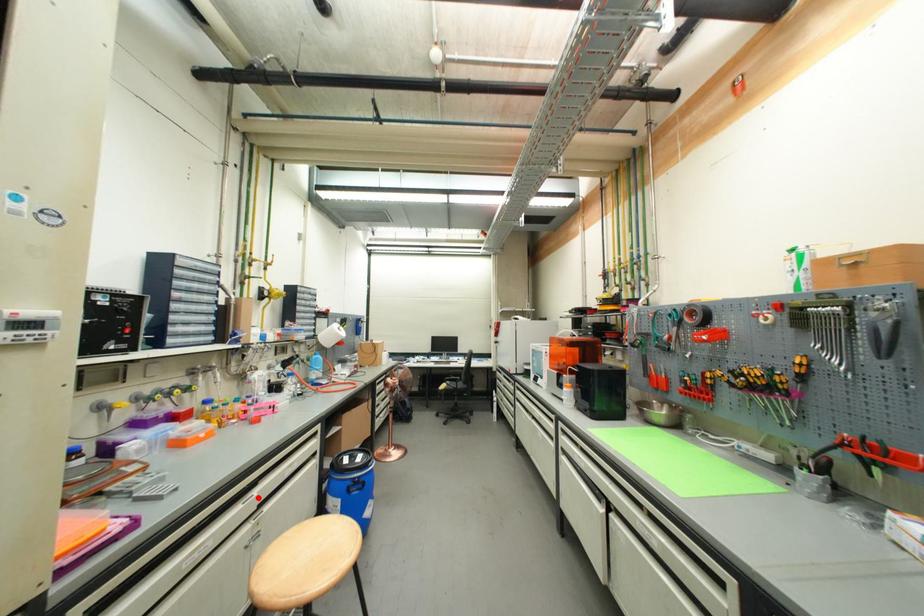
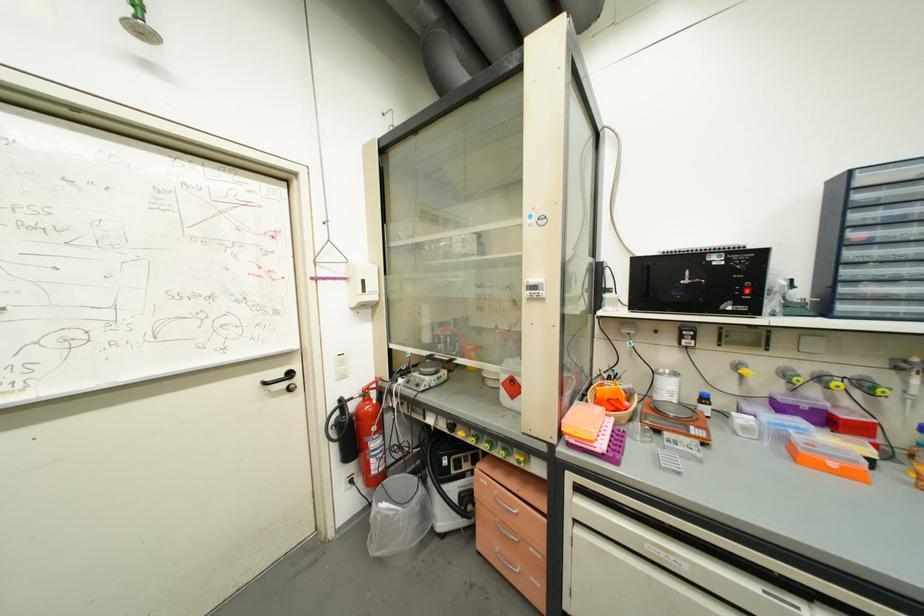
Find the pixel in the second image that matches the highlighted location in the first image.

(803, 610)